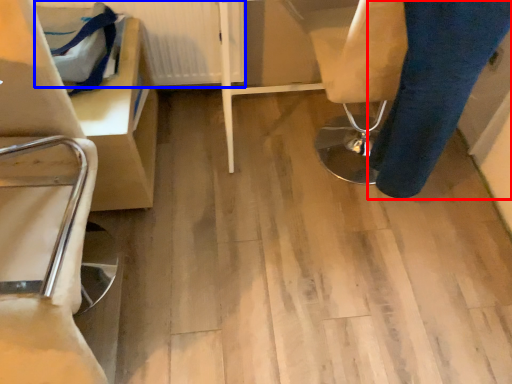
Question: Which object appears farthest to the camera in this image, trousers (highlighted by a red box) or radiator (highlighted by a blue box)?

Choices:
 (A) trousers
 (B) radiator

Answer: (B)